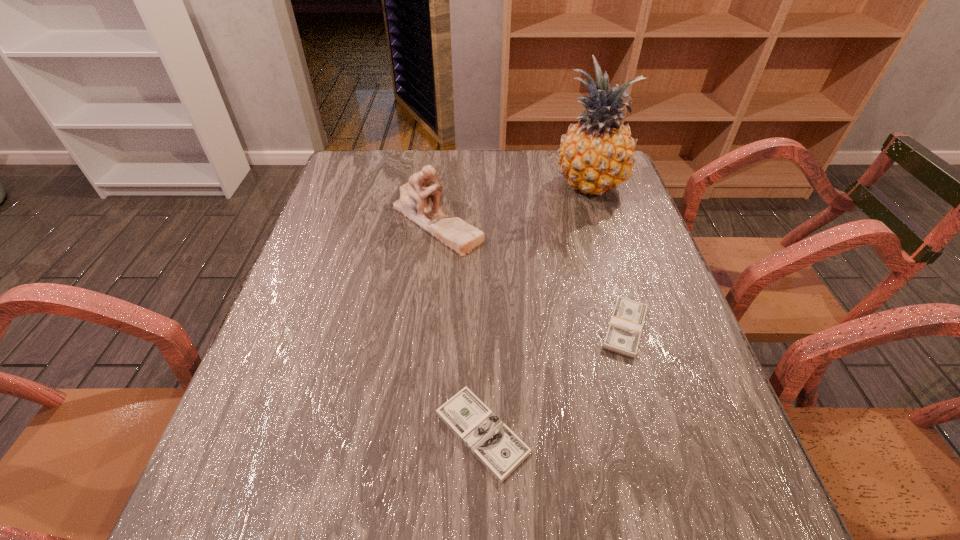
The image size is (960, 540). I want to click on object that is at the far edge, so click(596, 155).

Find the location of `pineapple that is at the right edge`. pineapple that is at the right edge is located at coordinates (596, 155).

Where is `dollar located at the right edge`? Image resolution: width=960 pixels, height=540 pixels. dollar located at the right edge is located at coordinates (625, 327).

The image size is (960, 540). Find the location of `object at the far right corner`. object at the far right corner is located at coordinates (596, 155).

Find the location of a particular element. Image resolution: width=960 pixels, height=540 pixels. free space at the far edge is located at coordinates (550, 158).

Where is `vacant space at the left edge of the desktop`? The height and width of the screenshot is (540, 960). vacant space at the left edge of the desktop is located at coordinates (319, 231).

This screenshot has width=960, height=540. I want to click on free spot at the right edge of the desktop, so click(687, 394).

You are a GUI agent. You are given a task and a screenshot of the screen. Output one action in this format:
    pyautogui.click(x=<x>, y=<y>)
    Task: Click on the vacant space that is in between the nearer dollar and the second tallest object
    This screenshot has width=960, height=540.
    Given the screenshot: What is the action you would take?
    pyautogui.click(x=459, y=327)

Where is `vacant area that lies between the third shortest object and the pineapple`? The width and height of the screenshot is (960, 540). vacant area that lies between the third shortest object and the pineapple is located at coordinates (514, 204).

You are a GUI agent. You are given a task and a screenshot of the screen. Output one action in this format:
    pyautogui.click(x=<x>, y=<y>)
    Task: Click on the free spot between the third shortest object and the pineapple
    The height and width of the screenshot is (540, 960).
    Given the screenshot: What is the action you would take?
    pyautogui.click(x=514, y=204)